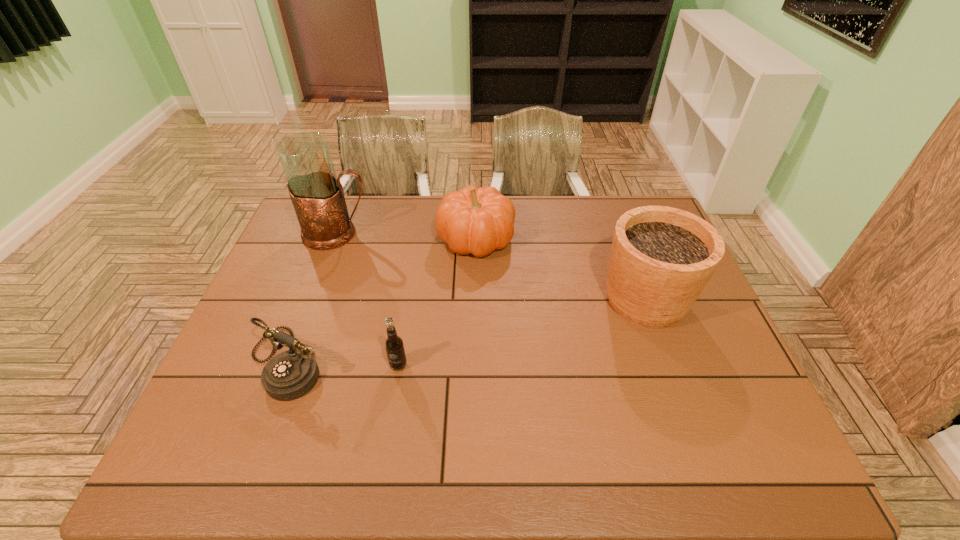
The height and width of the screenshot is (540, 960). What are the coordinates of `pitcher` in the screenshot? It's located at (317, 195).

Find the location of a particular element. the rightmost object is located at coordinates (661, 259).

I want to click on the fourth shortest object, so click(x=661, y=259).

Find the location of a particular element. The width and height of the screenshot is (960, 540). the fourth object from left to right is located at coordinates (474, 220).

What are the coordinates of `root beer` in the screenshot? It's located at (394, 346).

Locate an element on the screen. The image size is (960, 540). telephone is located at coordinates (289, 375).

Where is `vacant space located with the handle on the side of the pitcher`? The width and height of the screenshot is (960, 540). vacant space located with the handle on the side of the pitcher is located at coordinates 472,234.

Locate an element on the screen. vacant space situated on the front of the flowerpot is located at coordinates (670, 368).

Image resolution: width=960 pixels, height=540 pixels. What are the coordinates of `vacant space situated on the back of the fourth object from left to right` in the screenshot? It's located at (476, 204).

You are a GUI agent. You are given a task and a screenshot of the screen. Output one action in this format:
    pyautogui.click(x=<x>, y=<y>)
    Task: Click on the free region located on the label of the root beer
    
    Given the screenshot: What is the action you would take?
    pos(384,455)